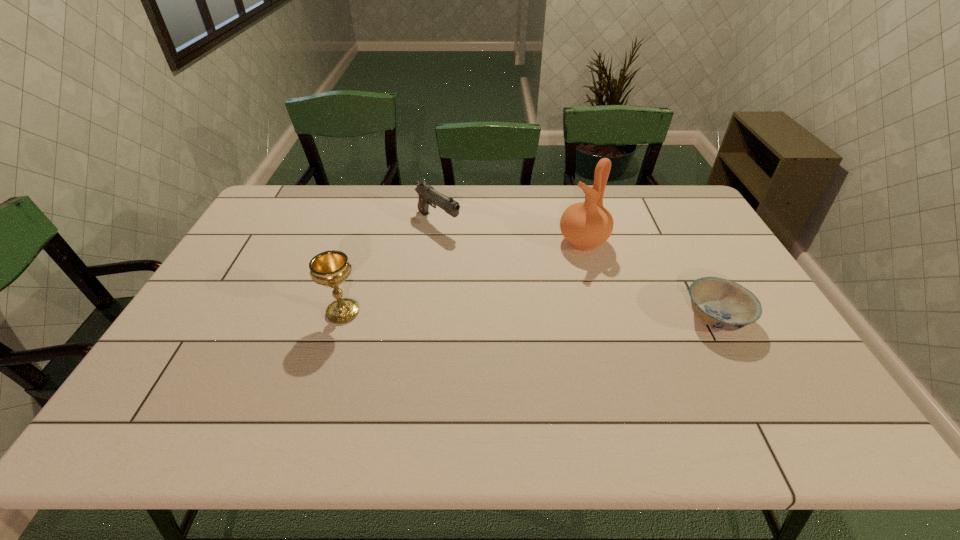
You are a GUI agent. You are given a task and a screenshot of the screen. Output one action in this format:
    pyautogui.click(x=<x>, y=<y>)
    Task: Click on the vacant space at the left edge of the desktop
    The width and height of the screenshot is (960, 540).
    Given the screenshot: What is the action you would take?
    pyautogui.click(x=181, y=336)

Find the location of `free spot at the right edge of the desktop`. free spot at the right edge of the desktop is located at coordinates (678, 248).

Identify the location of vacant space at the far left corner of the desktop. Image resolution: width=960 pixels, height=540 pixels. (260, 211).

Where is `free point at the far right corner`? The width and height of the screenshot is (960, 540). free point at the far right corner is located at coordinates (683, 185).

In the image, there is a desktop. Where is `blank space at the near right corner`? The height and width of the screenshot is (540, 960). blank space at the near right corner is located at coordinates (767, 367).

At what (x,y) coordinates should I click in order to perform the action: click on free space between the leftmost object and the second object from left to right. Please return your answer as a coordinate pair (x, y). Looking at the image, I should click on [391, 267].

Where is `vacant space in between the pottery and the second object from left to right`? vacant space in between the pottery and the second object from left to right is located at coordinates (511, 232).

Identify the location of free spot between the leftmost object and the second object from left to right. (391, 267).

Identify the location of vacant space in between the pottery and the third tallest object. The width and height of the screenshot is (960, 540). (511, 232).

Locate an element on the screen. vacant space in between the chalice and the tallest object is located at coordinates (463, 276).